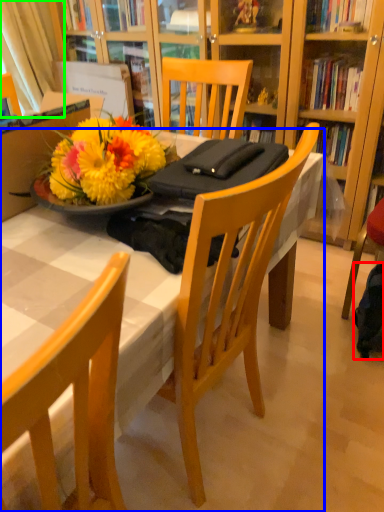
Question: Considering the real-world distances, which object is farthest from backpack (highlighted by a red box)? desk (highlighted by a blue box) or curtain (highlighted by a green box)?

Choices:
 (A) desk
 (B) curtain

Answer: (B)